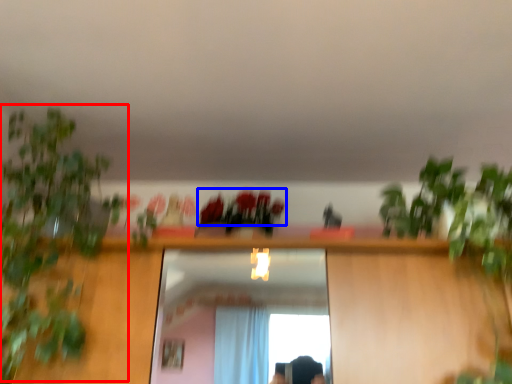
Question: Which point is closer to the camera, vegetation (highlighted by a red box) or flower (highlighted by a blue box)?

Choices:
 (A) vegetation
 (B) flower

Answer: (A)